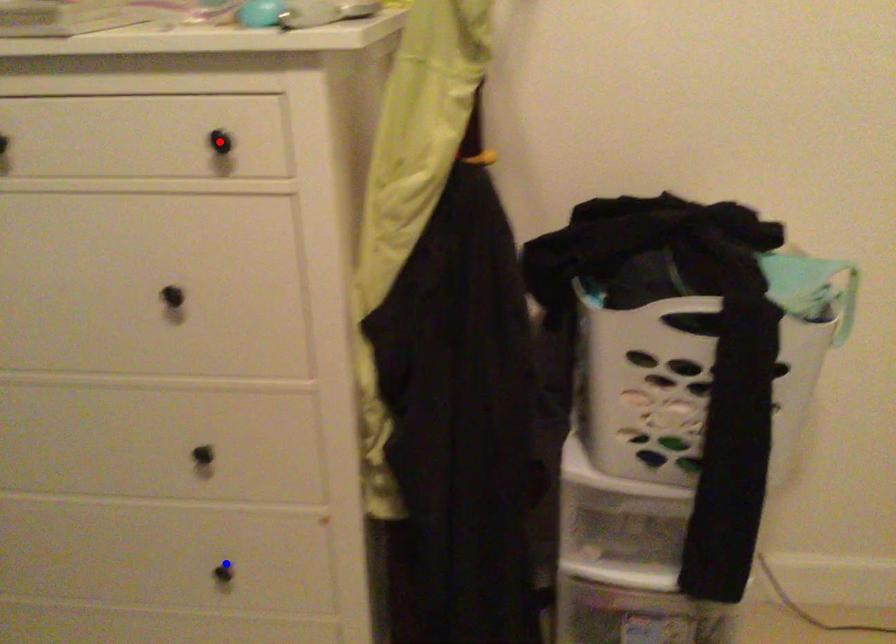
Question: In the image, two points are highlighted. Which point is nearer to the camera? Reply with the corresponding letter.

Choices:
 (A) blue point
 (B) red point

Answer: (B)